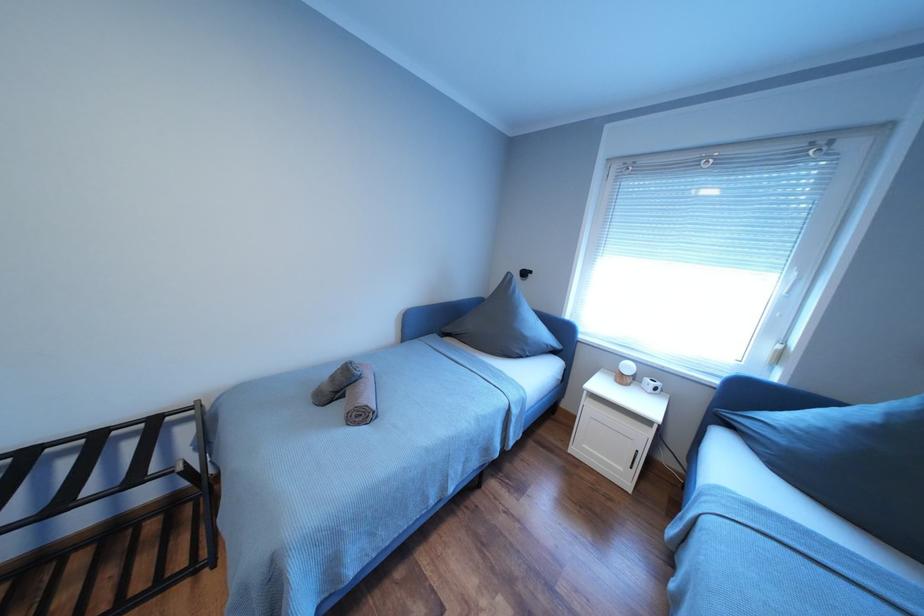
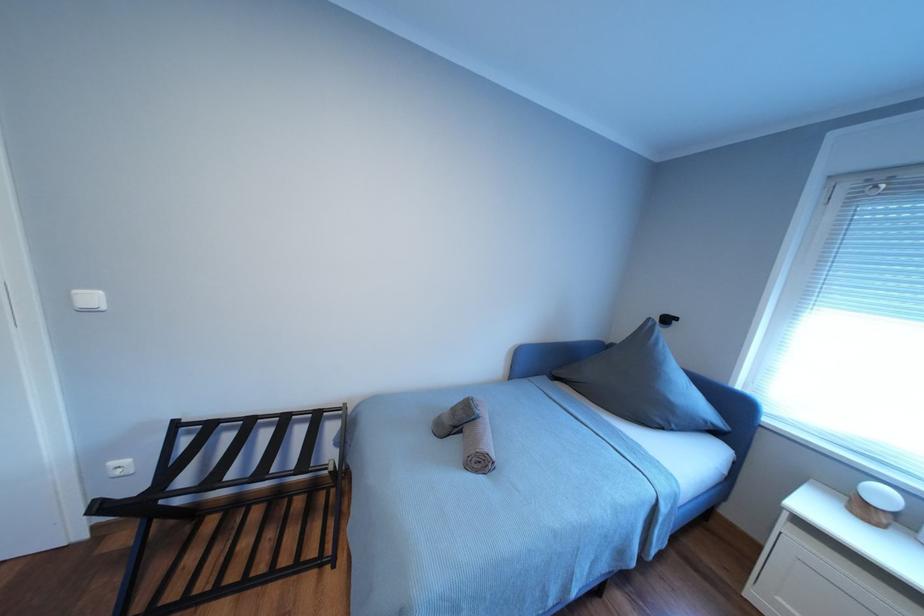
Question: Which direction would the cameraman need to move to produce the second image? Reply with the corresponding letter.

Choices:
 (A) Left
 (B) Right
 (C) Forward
 (D) Backward

Answer: (A)